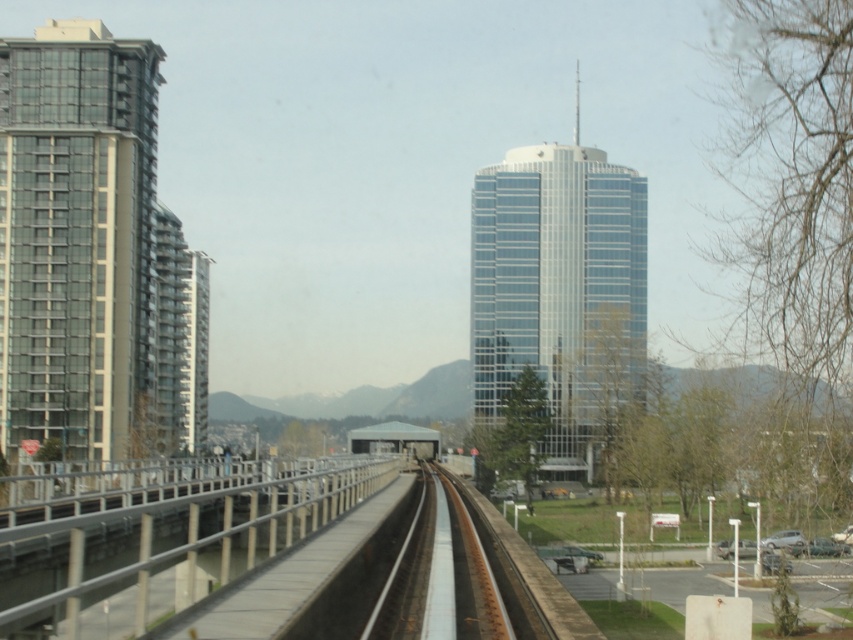
The width and height of the screenshot is (853, 640). Identify the location of glassy concrete building at left. (91, 256).

Does point (119, 323) come closer to viewer compared to point (485, 566)?

No, it is not.

Image resolution: width=853 pixels, height=640 pixels. Describe the element at coordinates (91, 256) in the screenshot. I see `glassy concrete building at left` at that location.

Locate an element on the screen. The width and height of the screenshot is (853, 640). glassy concrete building at left is located at coordinates coord(91,256).

Which is in front, point (543, 276) or point (438, 612)?

Point (438, 612) is more forward.

Which of these two, glassy blue skyscraper at center or smooth steel tracks at center, stands taller?

With more height is glassy blue skyscraper at center.

Describe the element at coordinates (560, 291) in the screenshot. Image resolution: width=853 pixels, height=640 pixels. I see `glassy blue skyscraper at center` at that location.

Locate an element on the screen. glassy blue skyscraper at center is located at coordinates coord(560,291).

Looking at this image, does glassy blue skyscraper at center have a greater width compared to white metal rail at center?

Yes, glassy blue skyscraper at center is wider than white metal rail at center.

How distant is glassy blue skyscraper at center from white metal rail at center?

glassy blue skyscraper at center is 78.86 meters from white metal rail at center.

Looking at this image, measure the distance between point (485, 280) and camera.

A distance of 144.79 meters exists between point (485, 280) and camera.

Find the location of `glassy blue skyscraper at center`. glassy blue skyscraper at center is located at coordinates (560, 291).